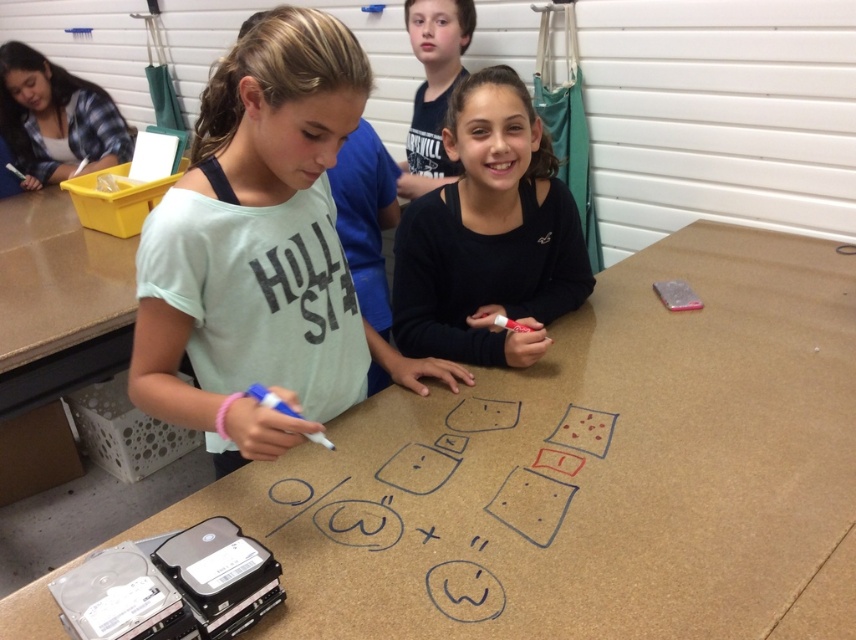
Question: Is brown matte table at center smaller than light green cotton shirt at center?

Choices:
 (A) yes
 (B) no

Answer: (B)

Question: Which of the following is the farthest from the observer?

Choices:
 (A) dark blue shirt at upper center
 (B) black matte shirt at center

Answer: (A)

Question: Among these points, which one is farthest from the camera?

Choices:
 (A) (236, 416)
 (B) (428, 125)
 (C) (296, 467)

Answer: (B)

Question: Which of these objects is positioned closest to the brown matte table at center?

Choices:
 (A) black matte shirt at center
 (B) dark blue shirt at upper center

Answer: (A)

Question: Does light green cotton shirt at center have a larger size compared to black matte shirt at center?

Choices:
 (A) yes
 (B) no

Answer: (A)

Question: Can you confirm if brown matte table at center is bigger than light green cotton shirt at center?

Choices:
 (A) yes
 (B) no

Answer: (A)